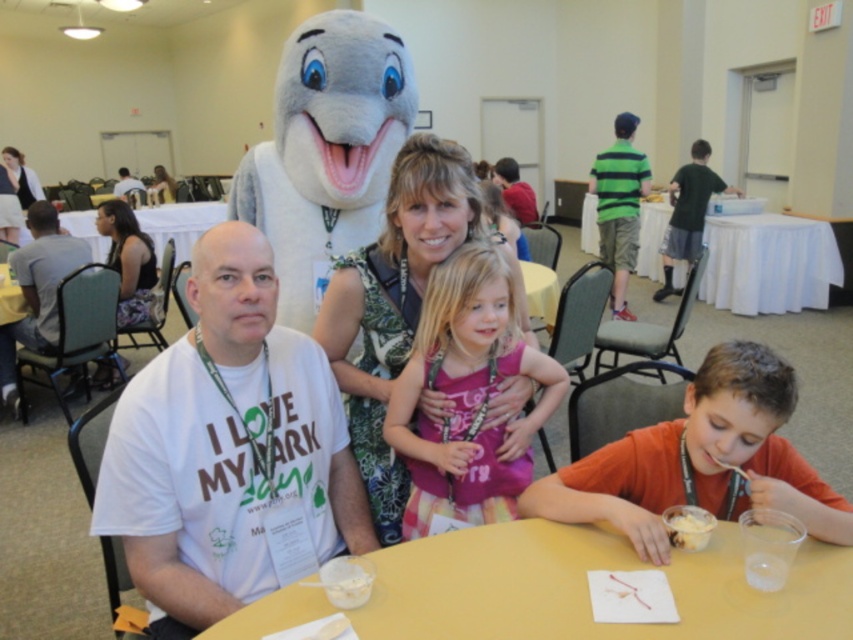
Question: Estimate the real-world distances between objects in this image. Which object is farther from the white creamy dessert at lower right?

Choices:
 (A) wooden table at center
 (B) white t-shirt at center
 (C) white cloth-covered table at center

Answer: (B)

Question: Is white cotton t-shirt at left above white plastic table at center?

Choices:
 (A) no
 (B) yes

Answer: (A)

Question: Does orange cotton shirt at lower right have a larger size compared to white cloth-covered table at center?

Choices:
 (A) yes
 (B) no

Answer: (B)

Question: Is orange cotton shirt at lower right to the left of white t-shirt at left from the viewer's perspective?

Choices:
 (A) no
 (B) yes

Answer: (A)

Question: Which point is farther from the camera taking this photo?

Choices:
 (A) (505, 547)
 (B) (160, 224)
 (C) (24, 323)

Answer: (B)

Question: Among these points, which one is nearest to the camera?

Choices:
 (A) (193, 240)
 (B) (215, 252)
 (C) (27, 282)

Answer: (B)